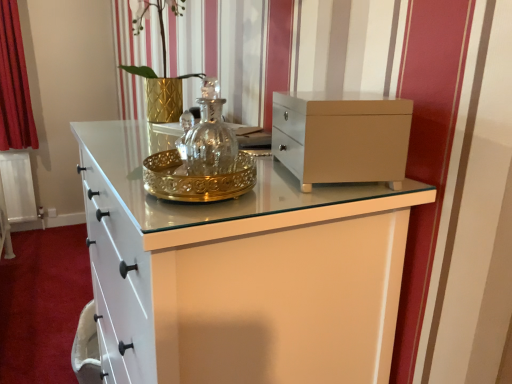
Question: Would you consider red velvet curtain at left to be distant from matte beige chest at upper center?

Choices:
 (A) yes
 (B) no

Answer: (A)

Question: Is red velvet curtain at left to the left of matte beige chest at upper center from the viewer's perspective?

Choices:
 (A) no
 (B) yes

Answer: (B)

Question: Is matte beige chest at upper center surrounded by red velvet curtain at left?

Choices:
 (A) yes
 (B) no

Answer: (B)

Question: From the image's perspective, is red velvet curtain at left over matte beige chest at upper center?

Choices:
 (A) yes
 (B) no

Answer: (A)

Question: Is red velvet curtain at left positioned behind matte beige chest at upper center?

Choices:
 (A) yes
 (B) no

Answer: (A)

Question: From the image's perspective, is red velvet curtain at left beneath matte beige chest at upper center?

Choices:
 (A) yes
 (B) no

Answer: (B)

Question: From the image's perspective, is matte beige chest at upper center under red velvet curtain at left?

Choices:
 (A) no
 (B) yes

Answer: (B)

Question: From a real-world perspective, is matte beige chest at upper center positioned under red velvet curtain at left based on gravity?

Choices:
 (A) no
 (B) yes

Answer: (A)

Question: Could you tell me if matte beige chest at upper center is turned towards red velvet curtain at left?

Choices:
 (A) yes
 (B) no

Answer: (B)

Question: Is matte beige chest at upper center to the right of red velvet curtain at left from the viewer's perspective?

Choices:
 (A) yes
 (B) no

Answer: (A)

Question: Does matte beige chest at upper center have a lesser width compared to red velvet curtain at left?

Choices:
 (A) no
 (B) yes

Answer: (B)

Question: Can you confirm if matte beige chest at upper center is shorter than red velvet curtain at left?

Choices:
 (A) yes
 (B) no

Answer: (A)

Question: Considering the positions of point (394, 122) and point (3, 81), is point (394, 122) closer or farther from the camera than point (3, 81)?

Choices:
 (A) closer
 (B) farther

Answer: (A)